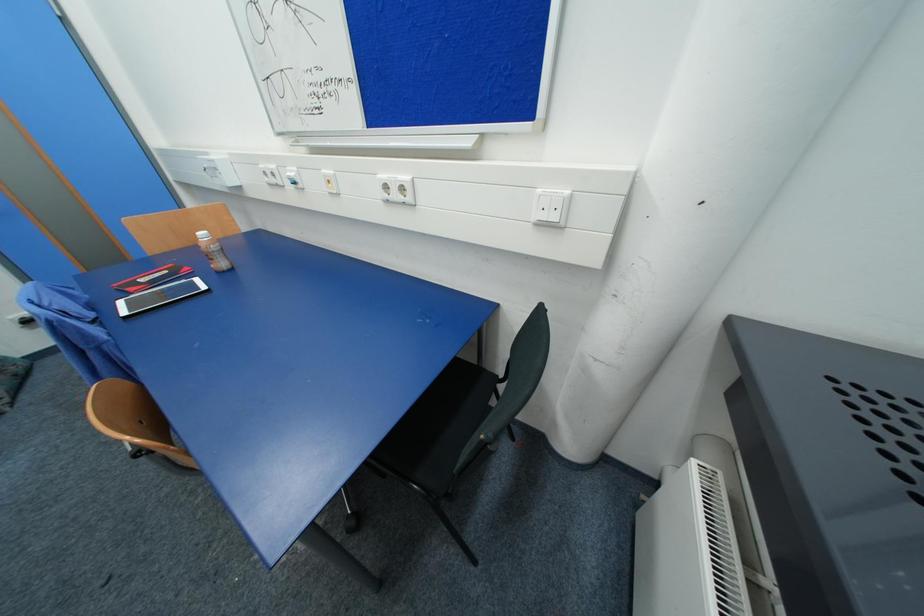
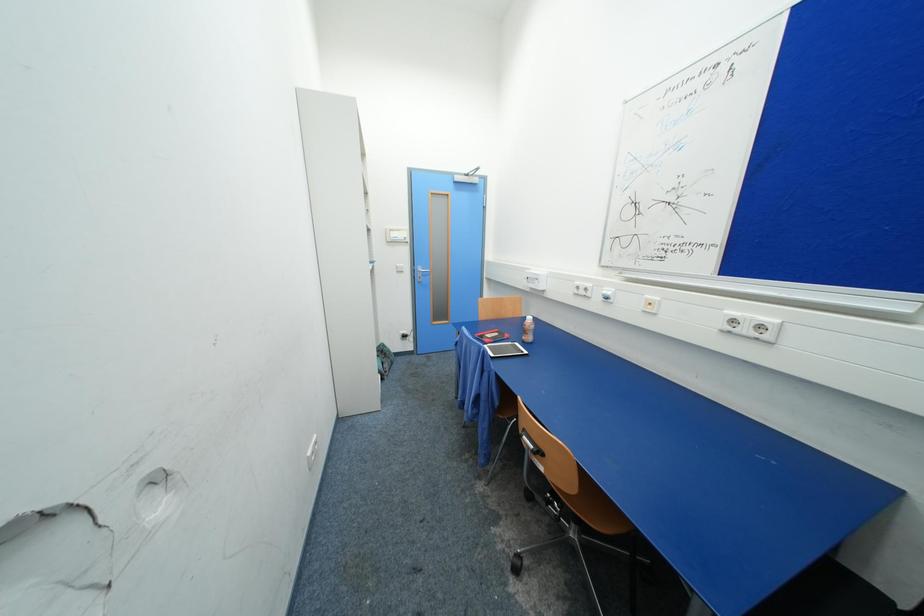
Question: Based on the continuous images, in which direction is the camera rotating? Reply with the corresponding letter.

Choices:
 (A) Left
 (B) Right
 (C) Up
 (D) Down

Answer: (A)